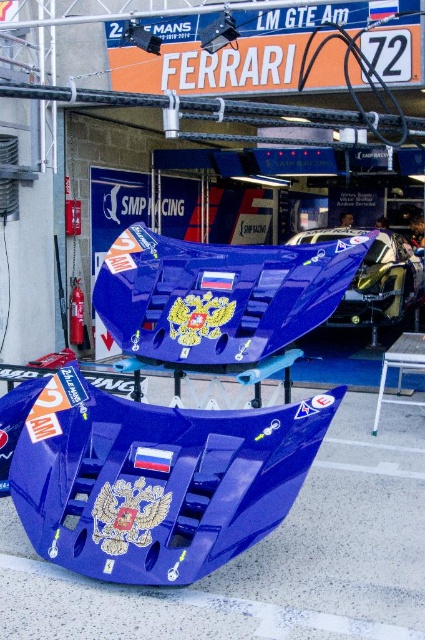
Can you confirm if glossy blue spoiler at center is shorter than glossy blue car at center?

Correct, glossy blue spoiler at center is not as tall as glossy blue car at center.

Which is above, glossy blue spoiler at center or glossy blue car at center?

Positioned higher is glossy blue car at center.

I want to click on glossy blue spoiler at center, so click(x=176, y=412).